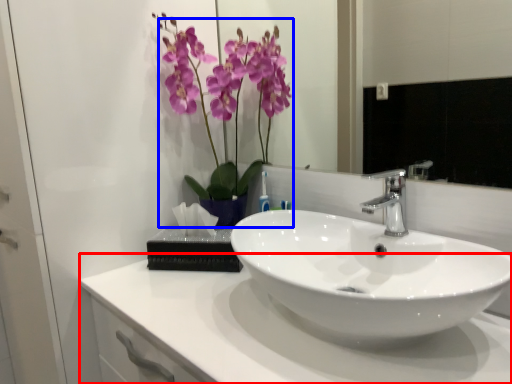
Question: Which of the following is the farthest to the observer, counter top (highlighted by a red box) or floral arrangement (highlighted by a blue box)?

Choices:
 (A) counter top
 (B) floral arrangement

Answer: (B)